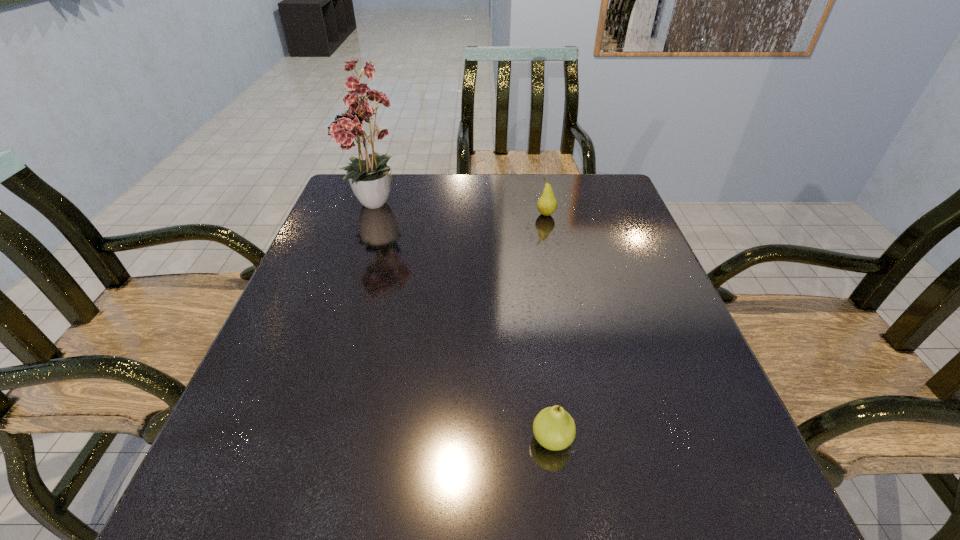
The width and height of the screenshot is (960, 540). Identify the location of the tallest object. (372, 180).

Find the location of a particular element. the leftmost object is located at coordinates (372, 180).

At what (x,y) coordinates should I click in order to perform the action: click on the farther pear. Please return your answer as a coordinate pair (x, y). Looking at the image, I should click on (547, 204).

Where is `the rightmost object`? The width and height of the screenshot is (960, 540). the rightmost object is located at coordinates (547, 204).

Where is `the left pear`? This screenshot has width=960, height=540. the left pear is located at coordinates (554, 428).

At what (x,y) coordinates should I click in order to perform the action: click on the second object from right to left. Please return your answer as a coordinate pair (x, y). Looking at the image, I should click on (554, 428).

Identify the location of vacant space located 0.090m on the front-facing side of the flower arrangement. The height and width of the screenshot is (540, 960). (361, 254).

Locate an element on the screen. The height and width of the screenshot is (540, 960). free space located 0.160m on the front of the rightmost object is located at coordinates (555, 256).

Where is `vacant space located on the right of the nearer pear`? This screenshot has height=540, width=960. vacant space located on the right of the nearer pear is located at coordinates (660, 439).

This screenshot has width=960, height=540. I want to click on flower arrangement present at the far edge, so click(x=372, y=180).